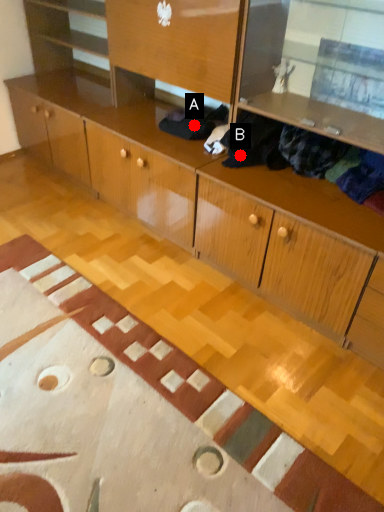
Question: Two points are circled on the image, labeled by A and B beside each circle. Among these points, which one is farthest from the camera?

Choices:
 (A) A is further
 (B) B is further

Answer: (A)